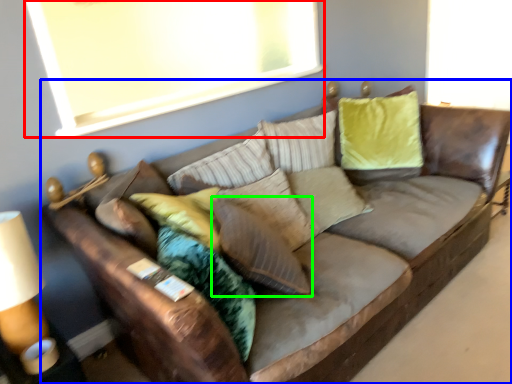
Question: Estimate the real-world distances between objects in this image. Which object is closer to window screen (highlighted by a red box), studio couch (highlighted by a blue box) or pillow (highlighted by a green box)?

Choices:
 (A) studio couch
 (B) pillow

Answer: (A)